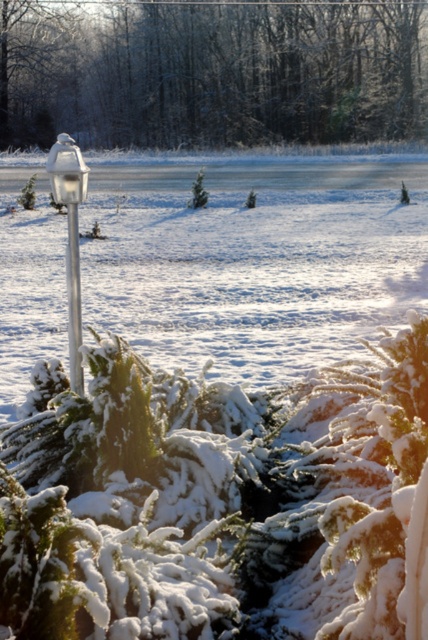
Is snow-covered evergreen at center further to the viewer compared to metallic pole at left?

Yes, it is.

You are a GUI agent. You are given a task and a screenshot of the screen. Output one action in this format:
    pyautogui.click(x=<x>, y=<y>)
    Task: Click on the snow-covered evergreen at center
    
    Given the screenshot: What is the action you would take?
    pyautogui.click(x=213, y=72)

Image resolution: width=428 pixels, height=640 pixels. What are the coordinates of `snow-covered evergreen at center` in the screenshot? It's located at (213, 72).